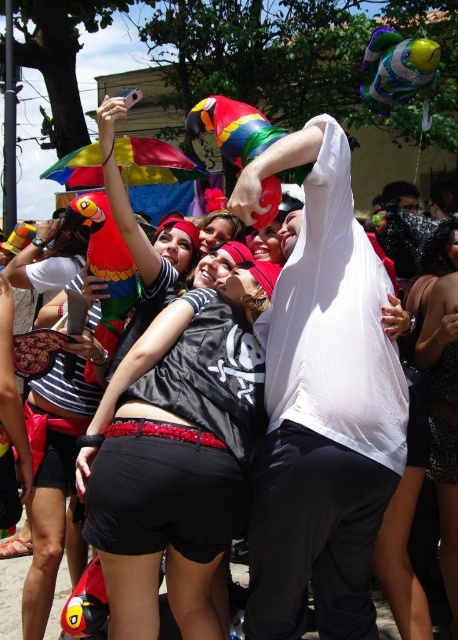
Question: Is black matte shorts at center below matte black shirt at center?

Choices:
 (A) yes
 (B) no

Answer: (A)

Question: Considering the relative positions of white matte shirt at center and black satin dress at lower right in the image provided, where is white matte shirt at center located with respect to black satin dress at lower right?

Choices:
 (A) left
 (B) right

Answer: (A)

Question: Estimate the real-world distances between objects in this image. Which object is farther from the black satin dress at lower right?

Choices:
 (A) matte black shirt at center
 (B) white matte shirt at center

Answer: (A)

Question: Does black satin dress at lower right appear under matte black shirt at center?

Choices:
 (A) no
 (B) yes

Answer: (B)

Question: Which point is farther to the camera?

Choices:
 (A) black sequined shorts at lower center
 (B) black matte shorts at center

Answer: (A)

Question: Which object appears farthest from the camera in this image?

Choices:
 (A) white matte shirt at center
 (B) black sequined shorts at lower center

Answer: (B)